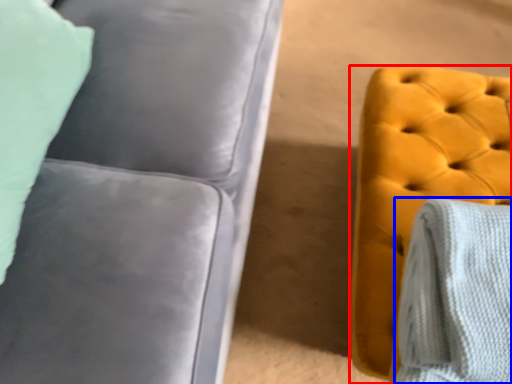
Question: Which object is closer to the camera taking this photo, furniture (highlighted by a red box) or blanket (highlighted by a blue box)?

Choices:
 (A) furniture
 (B) blanket

Answer: (B)